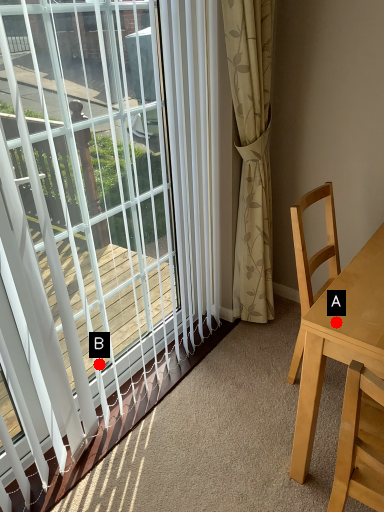
Question: Two points are circled on the image, labeled by A and B beside each circle. Among these points, which one is nearest to the camera?

Choices:
 (A) A is closer
 (B) B is closer

Answer: (A)